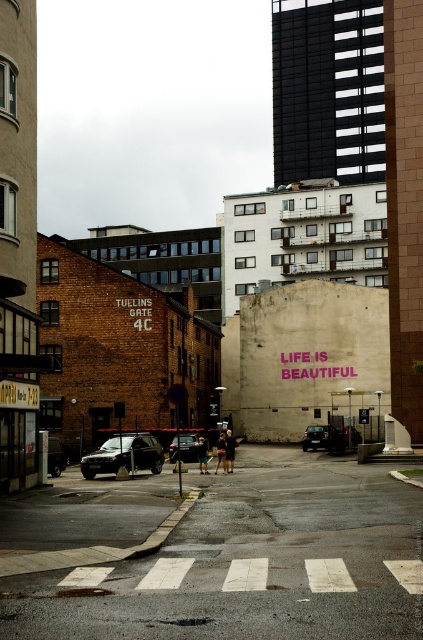
Question: Does shiny black suv at center appear over shiny silver sedan at center?

Choices:
 (A) no
 (B) yes

Answer: (B)

Question: Is matte black car at center thinner than dark gray metallic car at center-left?

Choices:
 (A) no
 (B) yes

Answer: (A)

Question: Can you confirm if matte black car at center is positioned above shiny silver sedan at center?

Choices:
 (A) yes
 (B) no

Answer: (B)

Question: Considering the real-world distances, which object is farthest from the shiny silver sedan at center?

Choices:
 (A) shiny black suv at center
 (B) dark gray metallic car at center-left
 (C) matte black car at center

Answer: (C)

Question: Which point is closer to the camera?

Choices:
 (A) shiny silver sedan at center
 (B) shiny black suv at center
 (C) matte black car at center

Answer: (B)

Question: Which object is closer to the camera taking this photo?

Choices:
 (A) shiny silver sedan at center
 (B) dark gray metallic car at center-left

Answer: (B)